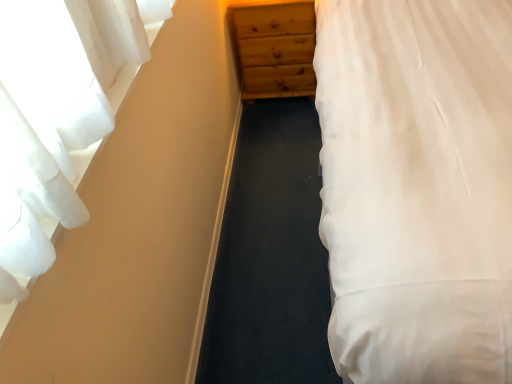
Question: Considering the relative positions of white sheer curtain at left and wooden chest of drawers at center in the image provided, is white sheer curtain at left to the left or to the right of wooden chest of drawers at center?

Choices:
 (A) left
 (B) right

Answer: (A)

Question: Relative to wooden chest of drawers at center, is white sheer curtain at left in front or behind?

Choices:
 (A) behind
 (B) front

Answer: (B)

Question: Which object is positioned farthest from the white sheer curtain at left?

Choices:
 (A) white cotton bed at right
 (B) wooden chest of drawers at center

Answer: (B)

Question: Estimate the real-world distances between objects in this image. Which object is farther from the wooden chest of drawers at center?

Choices:
 (A) white cotton bed at right
 (B) white sheer curtain at left

Answer: (B)